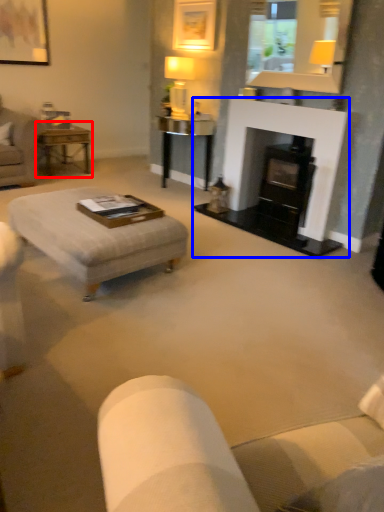
Question: Which point is further to the camera, table (highlighted by a red box) or fireplace (highlighted by a blue box)?

Choices:
 (A) table
 (B) fireplace

Answer: (A)